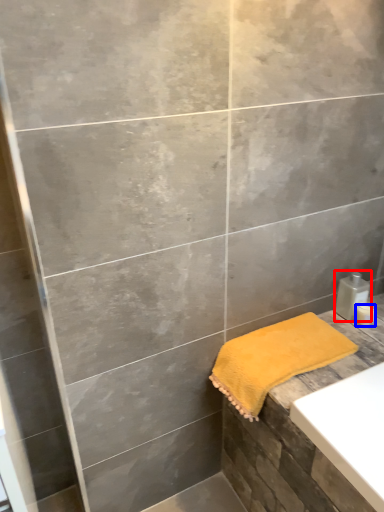
Question: Which point is further to the camera, soap dispenser (highlighted by a red box) or toiletry (highlighted by a blue box)?

Choices:
 (A) soap dispenser
 (B) toiletry

Answer: (B)